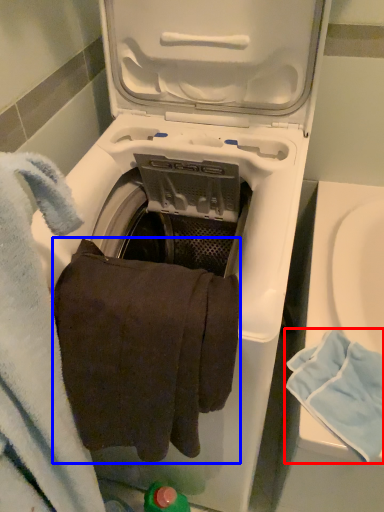
Question: Among these objects, which one is farthest to the camera, bath towel (highlighted by a red box) or bath towel (highlighted by a blue box)?

Choices:
 (A) bath towel
 (B) bath towel

Answer: (A)